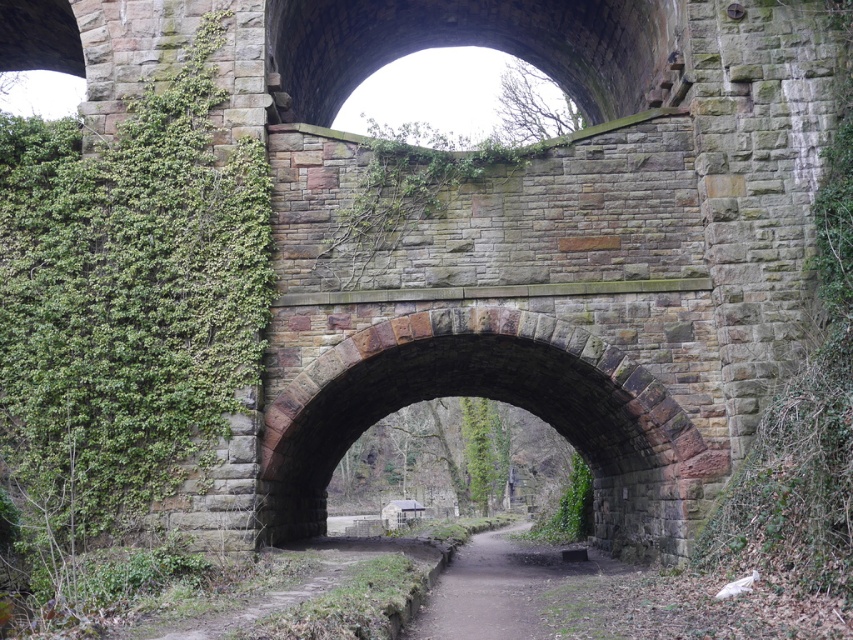
Based on the photo, can you confirm if green leafy ivy at left is bigger than dull brown dirt path at center?

Indeed, green leafy ivy at left has a larger size compared to dull brown dirt path at center.

Is point (48, 547) positioned in front of point (503, 582)?

Yes, it is in front of point (503, 582).

Find the location of a particular element. green leafy ivy at left is located at coordinates (125, 314).